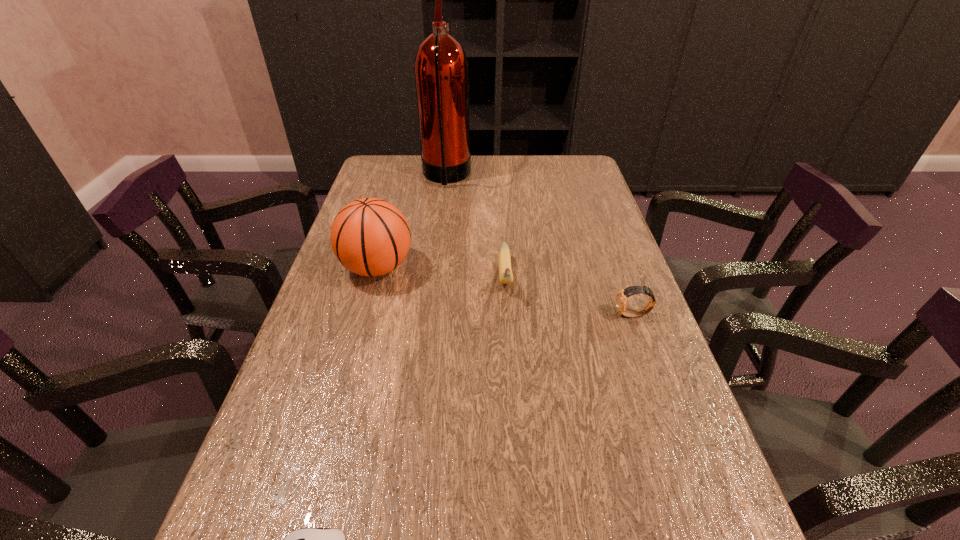
Where is `fire extinguisher`? The height and width of the screenshot is (540, 960). fire extinguisher is located at coordinates (441, 70).

The width and height of the screenshot is (960, 540). What are the coordinates of `the tallest object` in the screenshot? It's located at (441, 70).

Where is `basketball`? The image size is (960, 540). basketball is located at coordinates (370, 237).

You are a GUI agent. You are given a task and a screenshot of the screen. Output one action in this format:
    pyautogui.click(x=<x>, y=<y>)
    Task: Click on the fourth object from left to right
    The width and height of the screenshot is (960, 540).
    Given the screenshot: What is the action you would take?
    pyautogui.click(x=505, y=272)

The height and width of the screenshot is (540, 960). I want to click on the rightmost object, so click(x=621, y=298).

At what (x,y) coordinates should I click in order to perform the action: click on the second nearest object. Please return your answer as a coordinate pair (x, y). Looking at the image, I should click on (621, 298).

The image size is (960, 540). Find the location of `vacant area situated on the front-facing side of the tallest object`. vacant area situated on the front-facing side of the tallest object is located at coordinates (530, 177).

Image resolution: width=960 pixels, height=540 pixels. I want to click on free space located on the front of the basketball, so click(x=360, y=330).

The width and height of the screenshot is (960, 540). I want to click on vacant space positioned at the stem of the fourth object from left to right, so click(x=513, y=388).

This screenshot has width=960, height=540. Identify the location of free spot located 0.100m on the face of the watch. (571, 315).